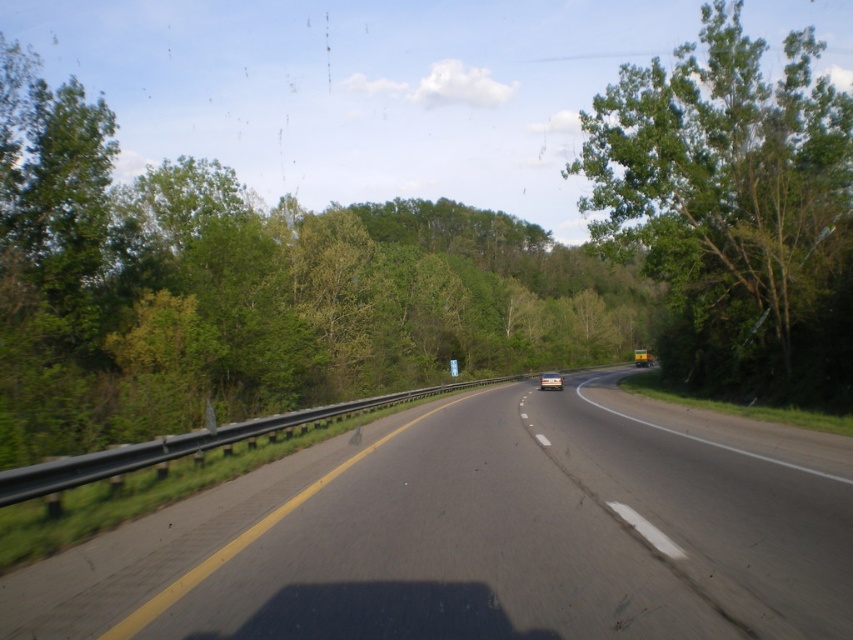
Question: Does green leafy tree at center appear over green leafy tree at right?

Choices:
 (A) no
 (B) yes

Answer: (A)

Question: Can you confirm if green leafy tree at center is bigger than silver metallic car at center?

Choices:
 (A) no
 (B) yes

Answer: (B)

Question: Which of the following is the farthest from the observer?

Choices:
 (A) (556, 372)
 (B) (786, 68)
 (C) (398, 600)
 (D) (607, 323)

Answer: (D)

Question: Estimate the real-world distances between objects in this image. Which object is farther from the green leafy tree at right?

Choices:
 (A) black asphalt highway at center
 (B) green leafy tree at center

Answer: (A)

Question: Which point is closer to the camera taking this photo?

Choices:
 (A) (605, 188)
 (B) (543, 376)
 (C) (337, 216)
 (D) (376, 516)

Answer: (D)

Question: Considering the relative positions of green leafy tree at center and green leafy tree at right in the image provided, where is green leafy tree at center located with respect to green leafy tree at right?

Choices:
 (A) below
 (B) above

Answer: (A)